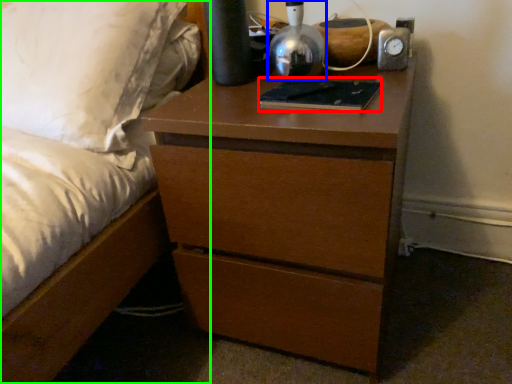
Question: Considering the real-world distances, which object is farthest from book (highlighted by a red box)? bedside lamp (highlighted by a blue box) or bed (highlighted by a green box)?

Choices:
 (A) bedside lamp
 (B) bed

Answer: (B)